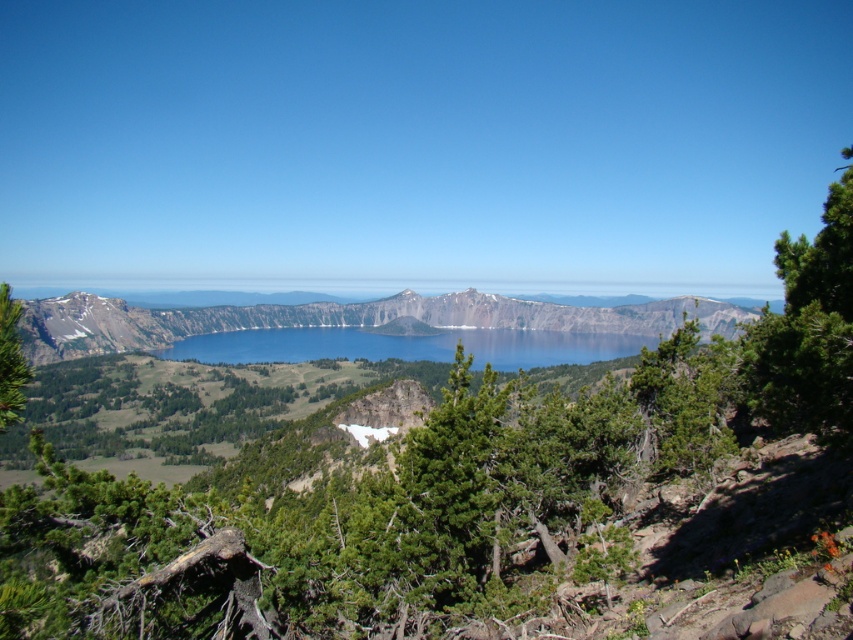
Is point (456, 328) positioned before point (1, 404)?

No.

In order to click on blue glassy water at center in this screenshot , I will do click(407, 346).

Who is shorter, rocky gray mountain at center or blue glassy water at center?

With less height is blue glassy water at center.

The width and height of the screenshot is (853, 640). I want to click on rocky gray mountain at center, so click(346, 320).

The width and height of the screenshot is (853, 640). Identify the location of rocky gray mountain at center. (x=346, y=320).

Is the position of rocky gray mountain at center more distant than that of green textured pine tree at left?

That is True.

Does rocky gray mountain at center appear under green textured pine tree at left?

No.

Identify the location of rocky gray mountain at center. (346, 320).